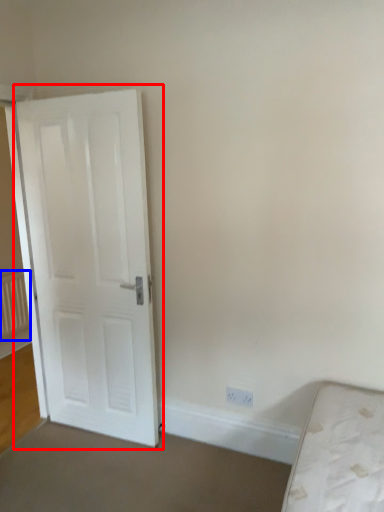
Question: Which point is further to the camera, door (highlighted by a red box) or radiator (highlighted by a blue box)?

Choices:
 (A) door
 (B) radiator

Answer: (B)